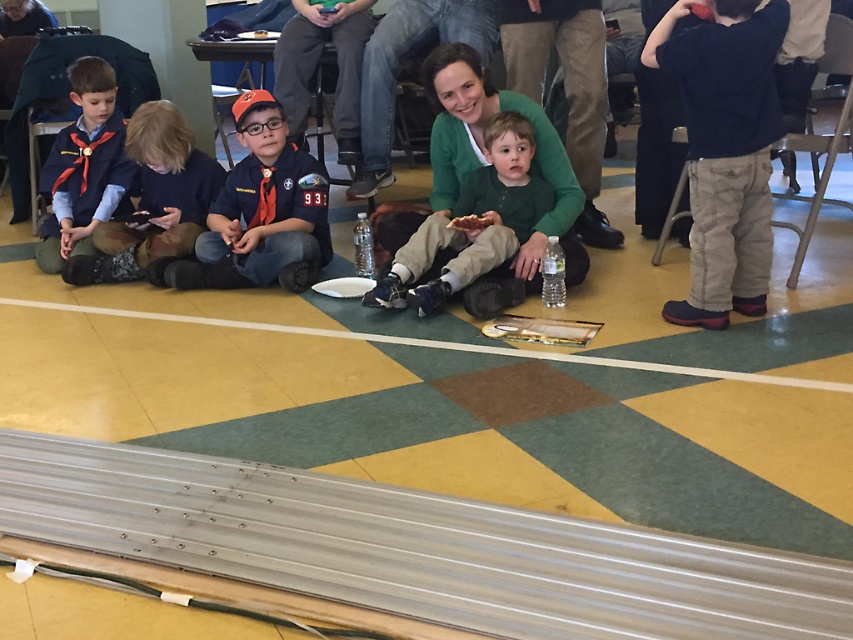
You are a photographer trying to capture a photo of the matte blue uniform at left and the matte orange cap at center. Based on their positions, which object is closer to the camera?

The matte orange cap at center is positioned under the matte blue uniform at left, which means it is closer to the camera.

You are a photographer trying to capture a photo of the dark blue sweater at upper right and the matte blue shirt at lower left. To ensure both are in the frame, should you adjust your camera to the left or right?

Since the dark blue sweater at upper right is to the right of the matte blue shirt at lower left, you should adjust your camera to the left to include both in the frame.